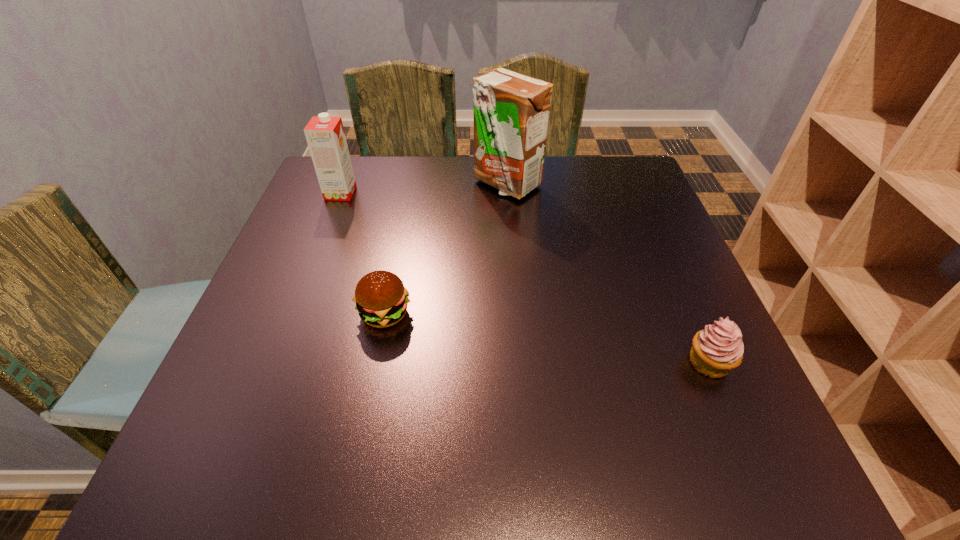
I want to click on free point between the third object from left to right and the hamburger, so click(x=445, y=248).

You are a GUI agent. You are given a task and a screenshot of the screen. Output one action in this format:
    pyautogui.click(x=<x>, y=<y>)
    Task: Click on the vacant area that lies between the taller carton and the left carton
    The image size is (960, 540).
    Given the screenshot: What is the action you would take?
    pyautogui.click(x=423, y=188)

Identify which object is located as the nearest to the right carton. Please provide its 2D coordinates. Your answer should be formatted as a tuple, i.e. [(x, y)], where the tuple contains the x and y coordinates of a point satisfying the conditions above.

[(325, 135)]

Locate which object is the closest to the leftmost object. Please provide its 2D coordinates. Your answer should be formatted as a tuple, i.e. [(x, y)], where the tuple contains the x and y coordinates of a point satisfying the conditions above.

[(511, 111)]

This screenshot has height=540, width=960. Find the location of `free spot that satisfies the following two spatial constraints: 1. on the front side of the rightmost object; 2. on the right side of the leftmost object`. free spot that satisfies the following two spatial constraints: 1. on the front side of the rightmost object; 2. on the right side of the leftmost object is located at coordinates (275, 362).

Locate an element on the screen. The height and width of the screenshot is (540, 960). vacant region that satisfies the following two spatial constraints: 1. on the straw side of the cupcake; 2. on the left side of the second object from right to left is located at coordinates (519, 362).

Locate an element on the screen. vacant area that satisfies the following two spatial constraints: 1. on the straw side of the cupcake; 2. on the right side of the right carton is located at coordinates (519, 362).

Locate an element on the screen. The image size is (960, 540). free space that satisfies the following two spatial constraints: 1. on the front side of the hamburger; 2. on the left side of the cupcake is located at coordinates (375, 362).